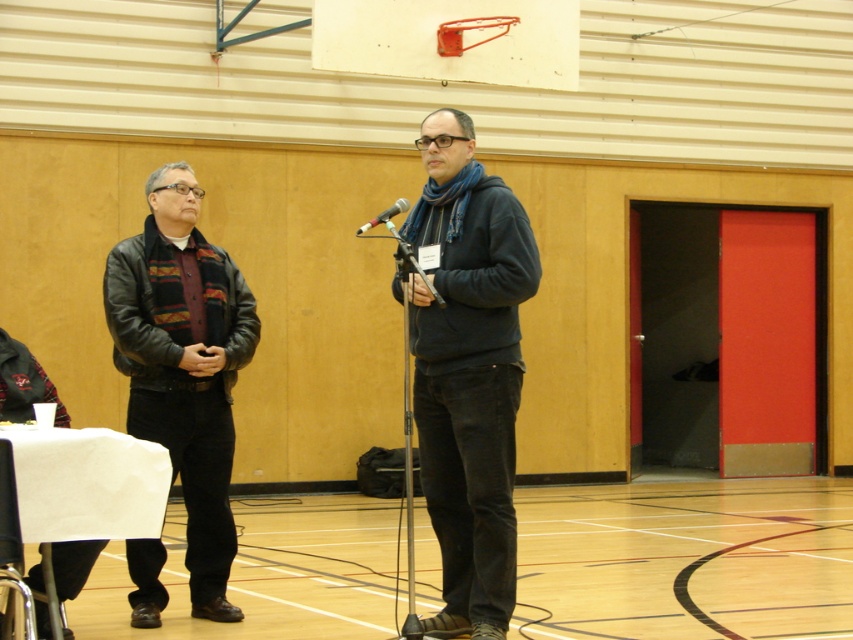
Between wooden floor at center and leather jacket at left, which one is positioned higher?

leather jacket at left is higher up.

Does point (122, 636) come behind point (134, 609)?

That is False.

Describe the element at coordinates (688, 557) in the screenshot. I see `wooden floor at center` at that location.

You are a GUI agent. You are given a task and a screenshot of the screen. Output one action in this format:
    pyautogui.click(x=<x>, y=<y>)
    Task: Click on the wooden floor at center
    
    Given the screenshot: What is the action you would take?
    pyautogui.click(x=688, y=557)

Can you confirm if dark gray hoodie at center is positioned to the right of silver metallic microphone at center?

Indeed, dark gray hoodie at center is positioned on the right side of silver metallic microphone at center.

Can you confirm if dark gray hoodie at center is positioned above silver metallic microphone at center?

No.

Locate an element on the screen. dark gray hoodie at center is located at coordinates (468, 371).

You are a GUI agent. You are given a task and a screenshot of the screen. Output one action in this format:
    pyautogui.click(x=<x>, y=<y>)
    Task: Click on the dark gray hoodie at center
    
    Given the screenshot: What is the action you would take?
    pyautogui.click(x=468, y=371)

Can you confirm if wooden floor at center is wider than silver metallic microphone at center?

Correct, the width of wooden floor at center exceeds that of silver metallic microphone at center.

Is wooden floor at center taller than silver metallic microphone at center?

Indeed, wooden floor at center has a greater height compared to silver metallic microphone at center.

Does point (643, 552) come behind point (358, 232)?

Yes, it is.

Where is `wooden floor at center`? The image size is (853, 640). wooden floor at center is located at coordinates [x=688, y=557].